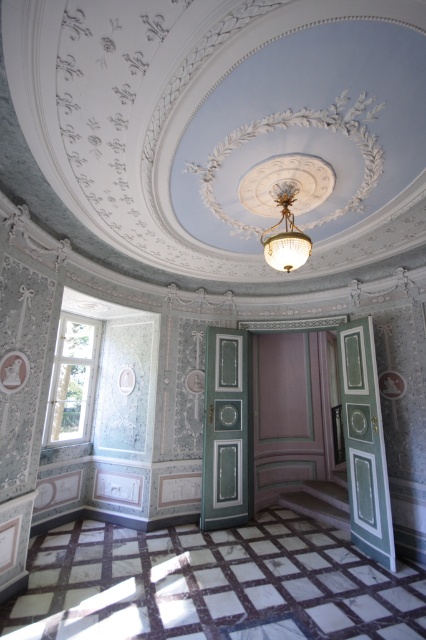
Question: Among these points, which one is farthest from the camera?

Choices:
 (A) (207, 420)
 (B) (363, 548)

Answer: (A)

Question: Is green painted wood door at right below gold crystal chandelier at center?

Choices:
 (A) yes
 (B) no

Answer: (A)

Question: Does green painted wood door at right have a greater width compared to gold crystal chandelier at center?

Choices:
 (A) no
 (B) yes

Answer: (A)

Question: Considering the relative positions of green painted wood door at right and green glossy door at center in the image provided, where is green painted wood door at right located with respect to green glossy door at center?

Choices:
 (A) below
 (B) above

Answer: (B)

Question: Which point appears closest to the camera in this image?

Choices:
 (A) (383, 509)
 (B) (288, 230)
 (C) (233, 390)

Answer: (B)

Question: Which is nearer to the gold crystal chandelier at center?

Choices:
 (A) green painted wood door at right
 (B) green glossy door at center

Answer: (A)